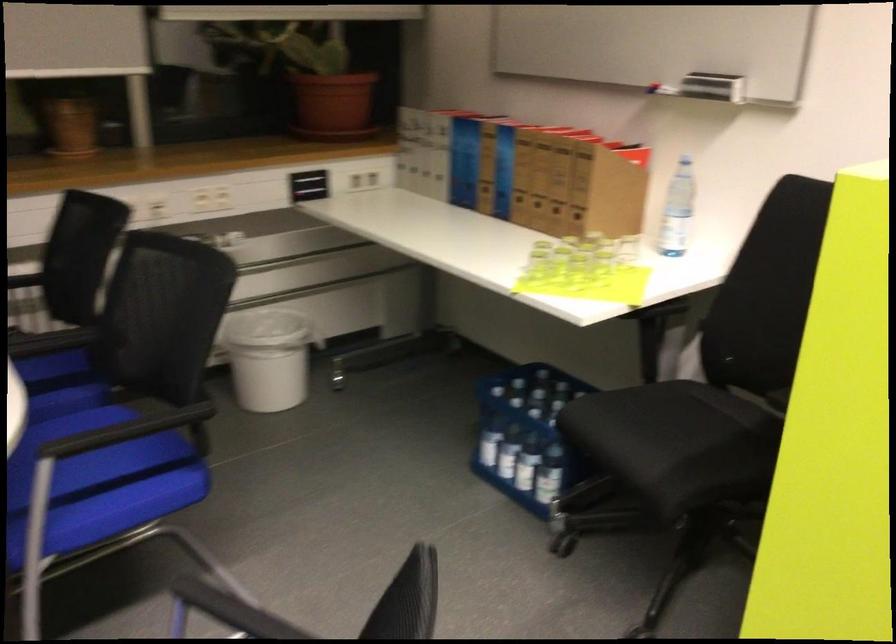
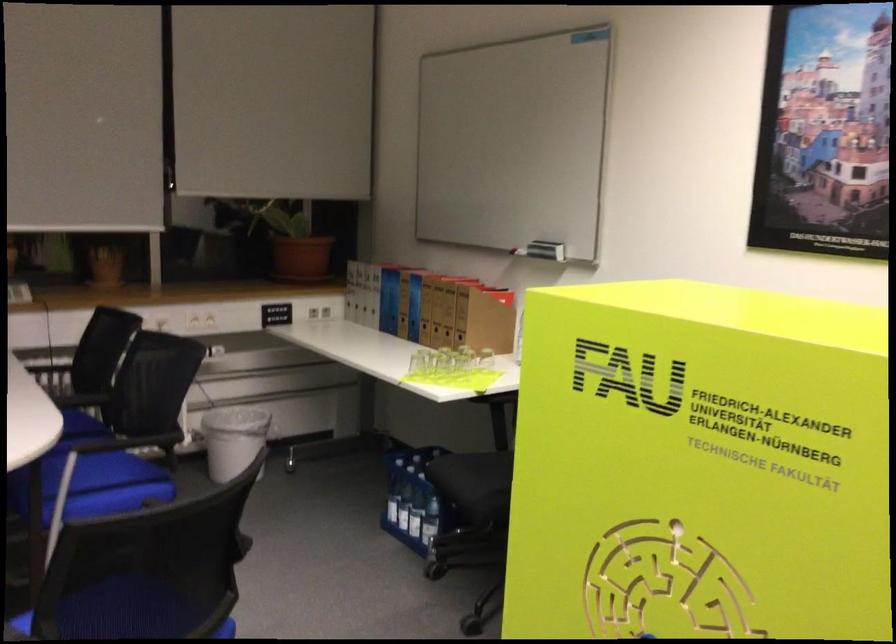
Where in the second image is the point corresponding to point (708, 91) from the first image?

(546, 250)